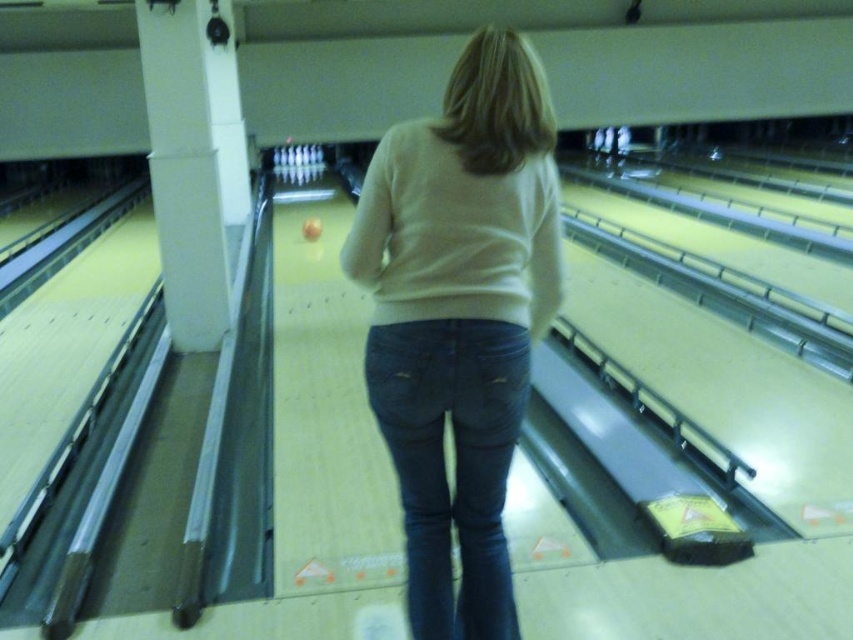
You are observing a person bowling and notice their clothing. Where is the light beige sweater at center positioned relative to the bowling lane dividers?

The light beige sweater at center is positioned near the center of the bowling lane, between the dark gray lane dividers on either side, as it is located at coordinates point (459, 317).

You are a photographer trying to capture a closeup shot of the light beige sweater at center and dark blue denim jeans at center. Your camera has a maximum focus range of 2.5 inches. Can you focus on both objects simultaneously?

The distance between the light beige sweater at center and dark blue denim jeans at center is 2.75 inches. Since the camera can only focus within 2.5 inches, you cannot focus on both objects at the same time.

You are a fashion designer analyzing the outfit of the person in the image. Which item of clothing has a larger size measurement between the light beige sweater at center and the dark blue denim jeans at center?

The light beige sweater at center is larger in size than the dark blue denim jeans at center according to the description.